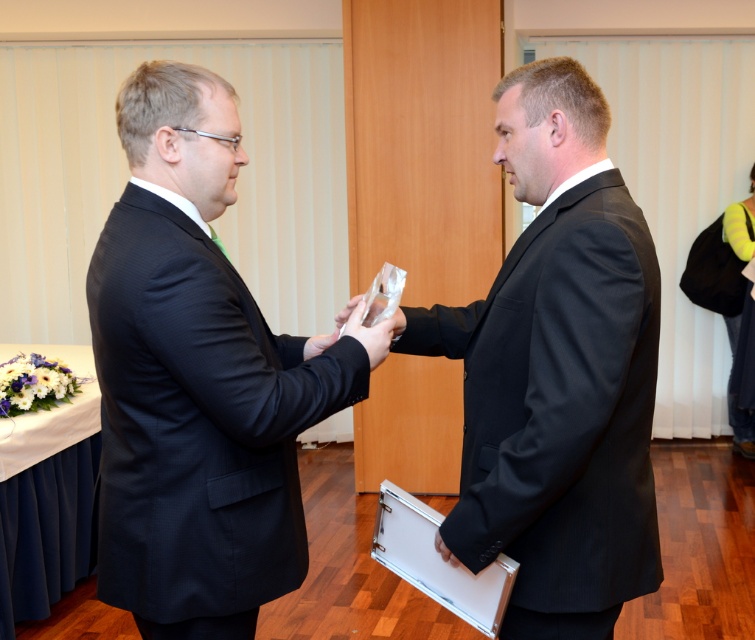
Between black pinstripe suit at center and translucent plastic hand at center, which one is positioned lower?

black pinstripe suit at center

Who is more forward, (618, 259) or (368, 344)?

Positioned in front is point (618, 259).

Describe the element at coordinates (556, 372) in the screenshot. I see `black pinstripe suit at center` at that location.

You are a GUI agent. You are given a task and a screenshot of the screen. Output one action in this format:
    pyautogui.click(x=<x>, y=<y>)
    Task: Click on the black pinstripe suit at center
    This screenshot has width=755, height=640.
    Given the screenshot: What is the action you would take?
    pyautogui.click(x=556, y=372)

Can you confirm if matte black suit at left is positioned above translucent plastic hand at center?

Actually, matte black suit at left is below translucent plastic hand at center.

Who is more distant from viewer, [282,540] or [396,316]?

The point [396,316] is behind.

Image resolution: width=755 pixels, height=640 pixels. I want to click on matte black suit at left, so (x=196, y=380).

Does matte black suit at left have a lesser height compared to black pinstripe suit at center?

Yes, matte black suit at left is shorter than black pinstripe suit at center.

Based on the photo, who is shorter, matte black suit at left or black pinstripe suit at center?

Standing shorter between the two is matte black suit at left.

Who is more forward, (297, 404) or (569, 308)?

Positioned in front is point (569, 308).

Identify the location of matte black suit at left. The height and width of the screenshot is (640, 755). (196, 380).